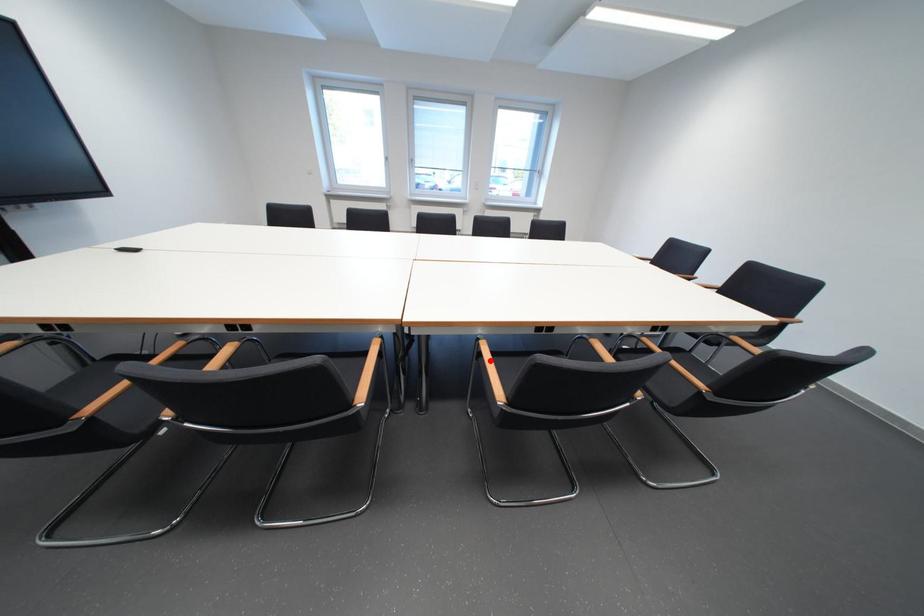
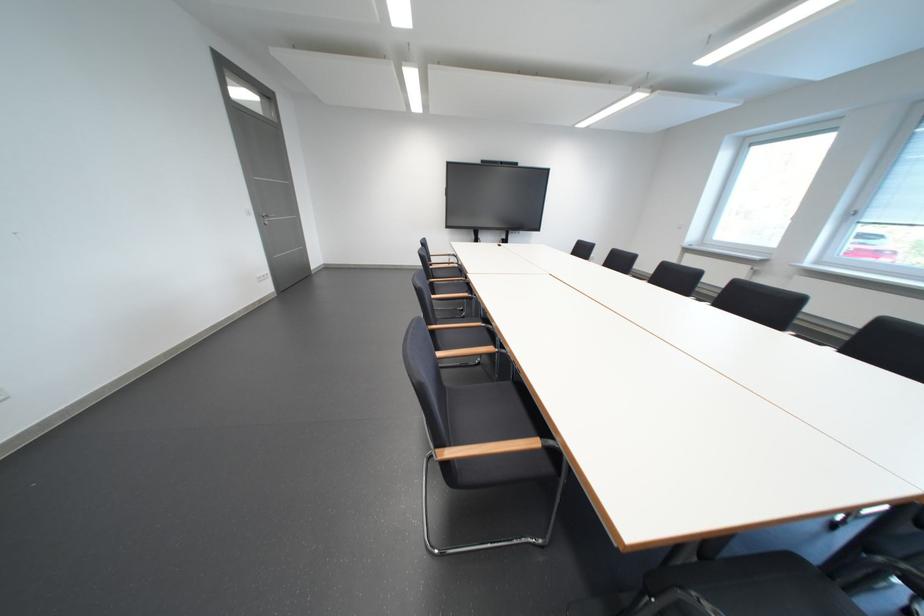
Question: I am providing you with two images of the same scene from different viewpoints. A red point is marked on the first image. Is the red point's position out of view in image 2?

Choices:
 (A) Yes
 (B) No

Answer: (A)